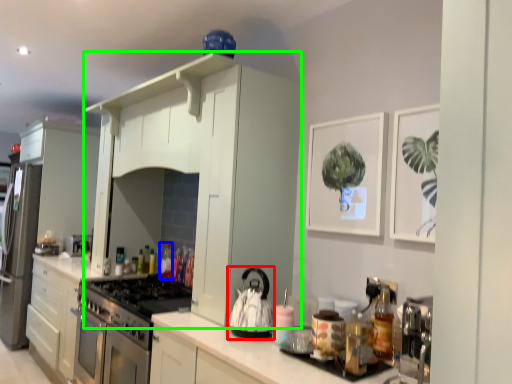
Question: Based on their relative distances, which object is farther from kitchen appliance (highlighted by a red box)? Choose from bottle (highlighted by a blue box) and cabinetry (highlighted by a green box).

Choices:
 (A) bottle
 (B) cabinetry

Answer: (A)